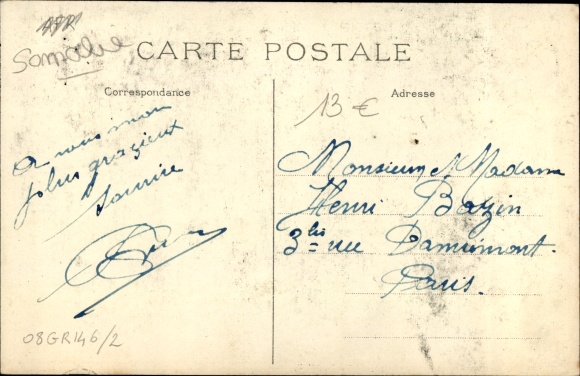
The height and width of the screenshot is (376, 580). What are the coordinates of `ink stain` in the screenshot? It's located at tap(63, 88), tap(87, 62), tap(72, 48), tap(59, 39), tap(188, 119), tap(416, 145), tap(484, 292), tap(556, 254), tap(506, 190).